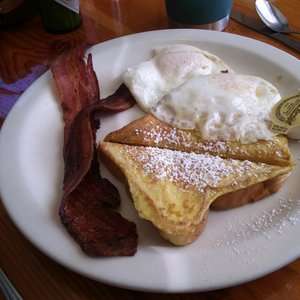
Find the location of a particular element. This screenshot has width=300, height=300. edge of the table is located at coordinates (9, 292).